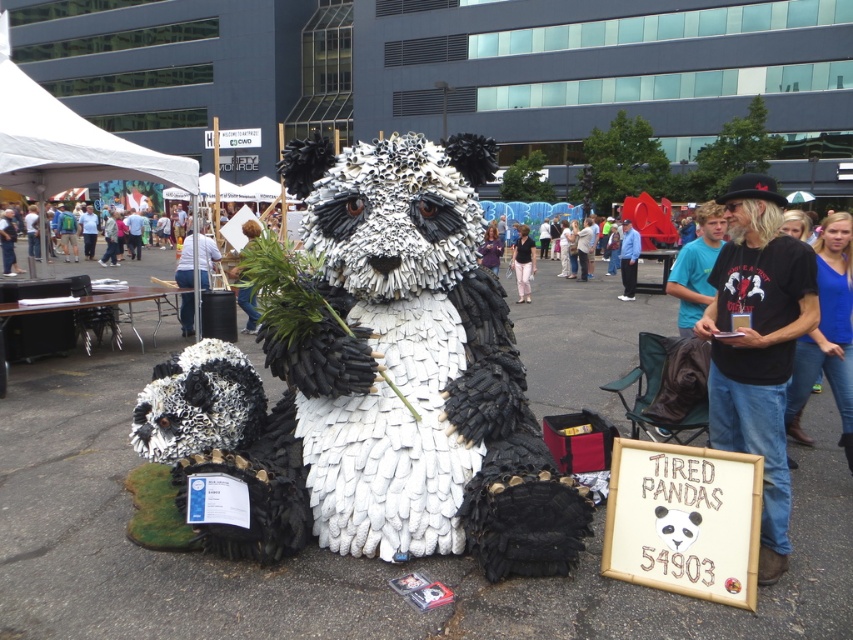
Is black t-shirt at right wider than white fabric canopy at upper left?

Incorrect, black t-shirt at right's width does not surpass white fabric canopy at upper left's.

Does point (757, 284) come in front of point (9, 188)?

Yes, it is.

Between point (790, 324) and point (53, 173), which one is positioned in front?

Point (790, 324) is in front.

The image size is (853, 640). I want to click on black t-shirt at right, so click(x=757, y=346).

Does blue cotton shirt at right have a greater height compared to blue t-shirt at center?

Indeed, blue cotton shirt at right has a greater height compared to blue t-shirt at center.

Between point (827, 257) and point (714, 240), which one is positioned behind?

The point (714, 240) is more distant.

Is point (840, 380) farther from viewer compared to point (698, 291)?

No, it is in front of (698, 291).

Identify the location of blue cotton shirt at right. Image resolution: width=853 pixels, height=640 pixels. (828, 328).

Can you confirm if white fabric canopy at upper left is positioned to the left of blue cotton shirt at right?

Yes, white fabric canopy at upper left is to the left of blue cotton shirt at right.

Is white fabric canopy at upper left positioned in front of blue cotton shirt at right?

No, white fabric canopy at upper left is behind blue cotton shirt at right.

The image size is (853, 640). Identify the location of white fabric canopy at upper left. (67, 141).